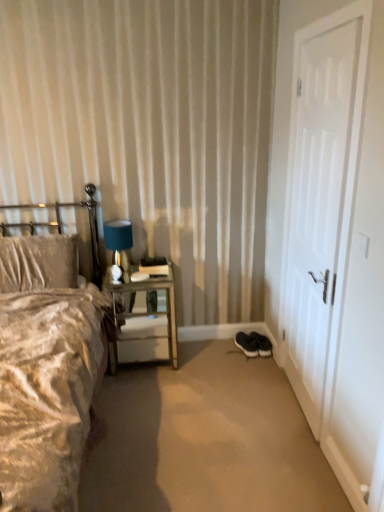
Question: Does metallic silver nightstand at left have a smaller size compared to black rubber shoes at lower right?

Choices:
 (A) yes
 (B) no

Answer: (B)

Question: Considering the relative sizes of metallic silver nightstand at left and black rubber shoes at lower right in the image provided, is metallic silver nightstand at left bigger than black rubber shoes at lower right?

Choices:
 (A) no
 (B) yes

Answer: (B)

Question: Is metallic silver nightstand at left not close to black rubber shoes at lower right?

Choices:
 (A) yes
 (B) no

Answer: (B)

Question: Is metallic silver nightstand at left oriented towards black rubber shoes at lower right?

Choices:
 (A) yes
 (B) no

Answer: (B)

Question: Is metallic silver nightstand at left completely or partially outside of black rubber shoes at lower right?

Choices:
 (A) no
 (B) yes

Answer: (B)

Question: Can you confirm if metallic silver nightstand at left is wider than black rubber shoes at lower right?

Choices:
 (A) no
 (B) yes

Answer: (A)

Question: Are metallic silver headboard at left and white matte door at right far apart?

Choices:
 (A) yes
 (B) no

Answer: (A)

Question: Is metallic silver headboard at left looking in the opposite direction of white matte door at right?

Choices:
 (A) no
 (B) yes

Answer: (A)

Question: Considering the relative sizes of metallic silver headboard at left and white matte door at right in the image provided, is metallic silver headboard at left thinner than white matte door at right?

Choices:
 (A) yes
 (B) no

Answer: (B)

Question: Is metallic silver headboard at left completely or partially outside of white matte door at right?

Choices:
 (A) no
 (B) yes

Answer: (B)

Question: Would you say metallic silver headboard at left contains white matte door at right?

Choices:
 (A) yes
 (B) no

Answer: (B)

Question: Considering the relative sizes of metallic silver headboard at left and white matte door at right in the image provided, is metallic silver headboard at left taller than white matte door at right?

Choices:
 (A) no
 (B) yes

Answer: (A)

Question: From the image's perspective, is white matte door at right located beneath metallic silver nightstand at left?

Choices:
 (A) yes
 (B) no

Answer: (B)